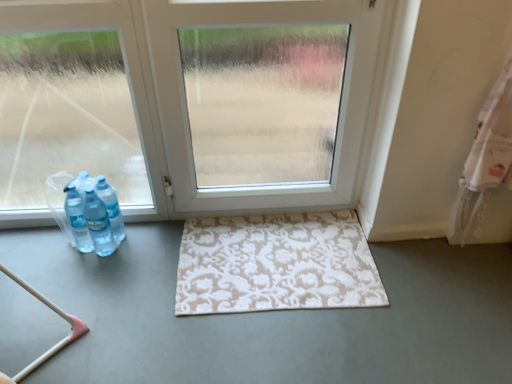
You are a GUI agent. You are given a task and a screenshot of the screen. Output one action in this format:
    pyautogui.click(x=<x>, y=<y>)
    Task: Click on the free location to the right of translucent plastic bottles at left
    This screenshot has width=512, height=384.
    Given the screenshot: What is the action you would take?
    pyautogui.click(x=145, y=244)